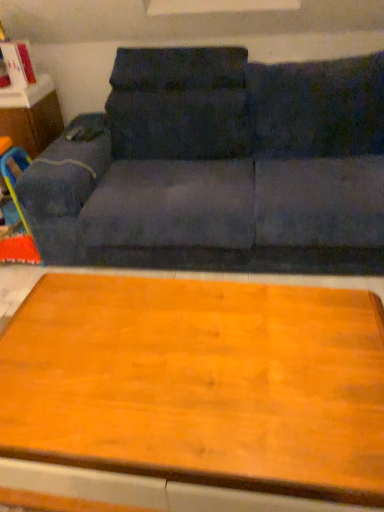
Question: Is wooden table at lower center taller than matte wood dresser at left?

Choices:
 (A) yes
 (B) no

Answer: (B)

Question: Does wooden table at lower center have a smaller size compared to matte wood dresser at left?

Choices:
 (A) no
 (B) yes

Answer: (A)

Question: Does wooden table at lower center appear on the right side of matte wood dresser at left?

Choices:
 (A) no
 (B) yes

Answer: (B)

Question: Could you tell me if wooden table at lower center is turned towards matte wood dresser at left?

Choices:
 (A) no
 (B) yes

Answer: (A)

Question: Does wooden table at lower center have a larger size compared to matte wood dresser at left?

Choices:
 (A) no
 (B) yes

Answer: (B)

Question: Considering their positions, is matte wood dresser at left located in front of or behind dark blue fabric couch at upper center?

Choices:
 (A) front
 (B) behind

Answer: (B)

Question: From the image's perspective, is matte wood dresser at left positioned above or below dark blue fabric couch at upper center?

Choices:
 (A) below
 (B) above

Answer: (B)

Question: Which is correct: matte wood dresser at left is inside dark blue fabric couch at upper center, or outside of it?

Choices:
 (A) inside
 (B) outside

Answer: (B)

Question: Does point (13, 100) appear closer or farther from the camera than point (337, 71)?

Choices:
 (A) closer
 (B) farther

Answer: (B)

Question: Do you think wooden table at lower center is within dark blue fabric couch at upper center, or outside of it?

Choices:
 (A) outside
 (B) inside

Answer: (A)

Question: In terms of width, does wooden table at lower center look wider or thinner when compared to dark blue fabric couch at upper center?

Choices:
 (A) wide
 (B) thin

Answer: (B)

Question: In terms of size, does wooden table at lower center appear bigger or smaller than dark blue fabric couch at upper center?

Choices:
 (A) big
 (B) small

Answer: (B)

Question: Based on their positions, is wooden table at lower center located to the left or right of dark blue fabric couch at upper center?

Choices:
 (A) right
 (B) left

Answer: (B)

Question: Looking at their shapes, would you say matte wood dresser at left is wider or thinner than wooden table at lower center?

Choices:
 (A) wide
 (B) thin

Answer: (B)

Question: Is matte wood dresser at left in front of or behind wooden table at lower center in the image?

Choices:
 (A) behind
 (B) front

Answer: (A)